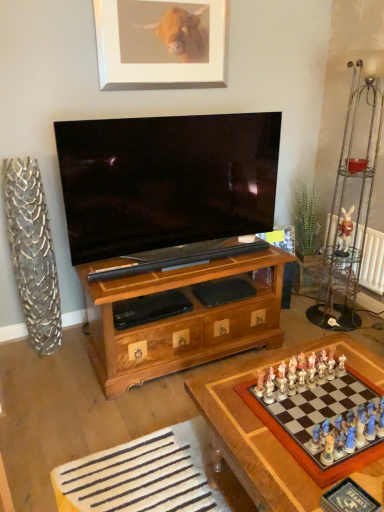
Locate an element on the screen. blank space situated above wooden chessboard at lower right (from a real-world perspective) is located at coordinates (304, 412).